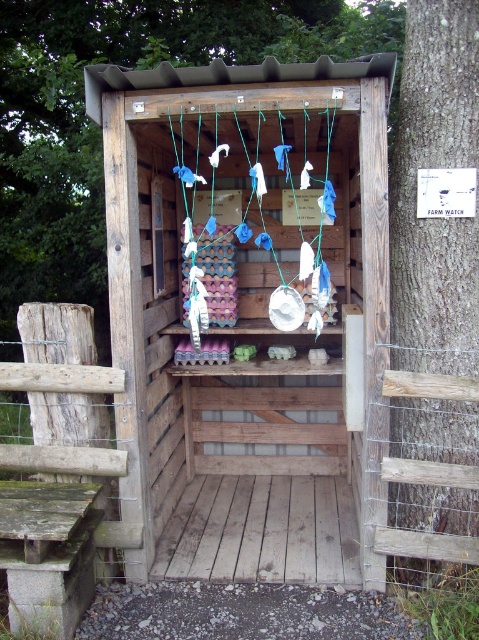
You are a delivery person who needs to place a 32 inch wide package between the wooden hut at center and the smooth bark tree at right. Is there enough space?

The distance between the wooden hut at center and the smooth bark tree at right is 34.01 inches, which is wider than the 32 inch package. Therefore, there is enough space to place the package between them.

You are standing at point 0.5, 0.5. You want to move to the wooden hut at center. Which direction should you move in?

Since you are at point (239, 320) and the wooden hut at center is at point (250, 316), you should move slightly north to reach it.

You are standing in a forest clearing where the wooden hut at center and the smooth bark tree at right are located. Which structure is taller?

The smooth bark tree at right is taller than the wooden hut at center.